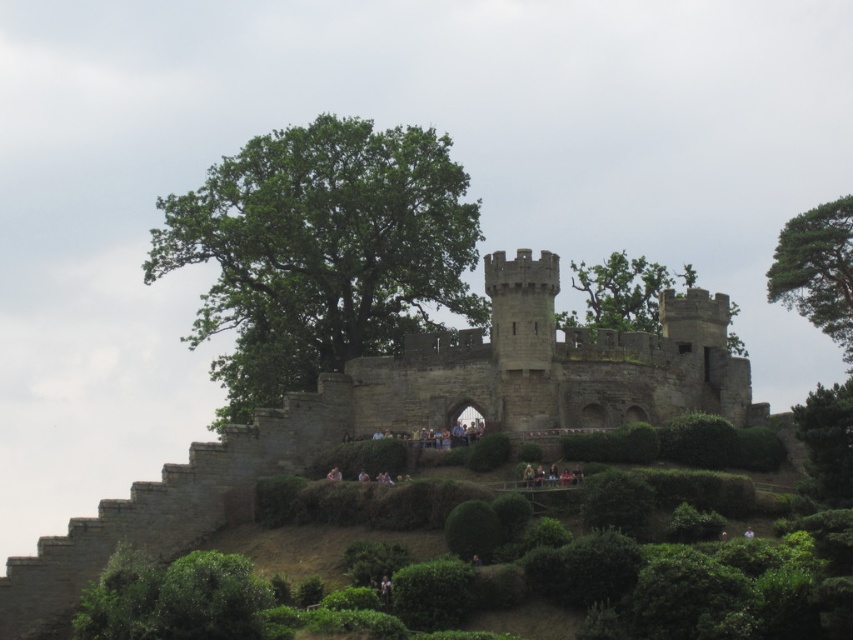
Question: Can you confirm if stone castle at center is bigger than green textured pine tree at upper right?

Choices:
 (A) no
 (B) yes

Answer: (B)

Question: Which of the following is the farthest from the observer?

Choices:
 (A) green textured pine tree at upper right
 (B) green leafy tree at upper right

Answer: (A)

Question: Which object is farther from the camera taking this photo?

Choices:
 (A) green leafy tree at upper right
 (B) green leafy tree at center
 (C) green leafy tree at upper center

Answer: (C)

Question: Can you confirm if green leafy tree at upper center is smaller than green leafy tree at upper right?

Choices:
 (A) no
 (B) yes

Answer: (B)

Question: Does stone castle at center appear on the left side of green leafy tree at upper right?

Choices:
 (A) no
 (B) yes

Answer: (B)

Question: Which object is positioned closest to the green textured pine tree at upper right?

Choices:
 (A) green leafy tree at center
 (B) stone castle at center
 (C) green leafy tree at upper center

Answer: (C)